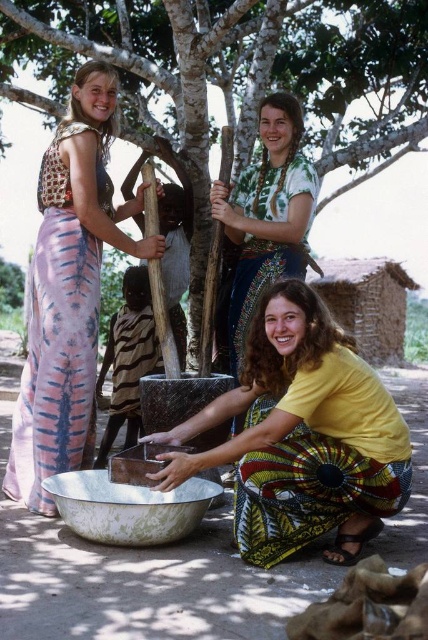
Question: Is yellow matte shirt at lower center above striped fabric cloth at center?

Choices:
 (A) yes
 (B) no

Answer: (B)

Question: Which of the following is the farthest from the observer?

Choices:
 (A) striped fabric cloth at center
 (B) pink tie-dye dress at left

Answer: (A)

Question: Among these objects, which one is nearest to the camera?

Choices:
 (A) green bark tree at upper center
 (B) green tie-dye shirt at upper center
 (C) greenish metallic bowl at lower center

Answer: (C)

Question: Observing the image, what is the correct spatial positioning of green bark tree at upper center in reference to striped fabric cloth at center?

Choices:
 (A) left
 (B) right

Answer: (B)

Question: Which point is farther to the camera?

Choices:
 (A) [210, 454]
 (B) [39, 6]

Answer: (B)

Question: Observing the image, what is the correct spatial positioning of yellow matte shirt at lower center in reference to striped fabric cloth at center?

Choices:
 (A) left
 (B) right

Answer: (B)